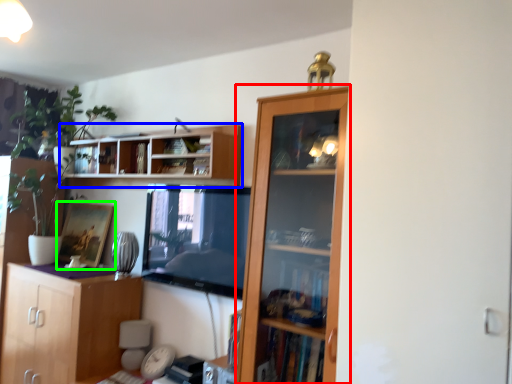
Question: Based on their relative distances, which object is nearer to cupboard (highlighted by a red box)? Choose from shelf (highlighted by a blue box) and picture frame (highlighted by a green box).

Choices:
 (A) shelf
 (B) picture frame

Answer: (A)